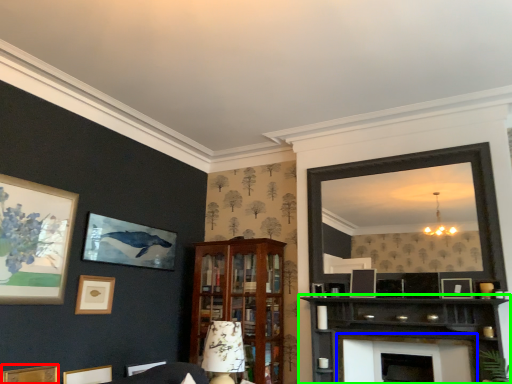
Question: Considering the real-world distances, which object is farthest from picture frame (highlighted by a red box)? fireplace (highlighted by a blue box) or shelf (highlighted by a green box)?

Choices:
 (A) fireplace
 (B) shelf

Answer: (A)